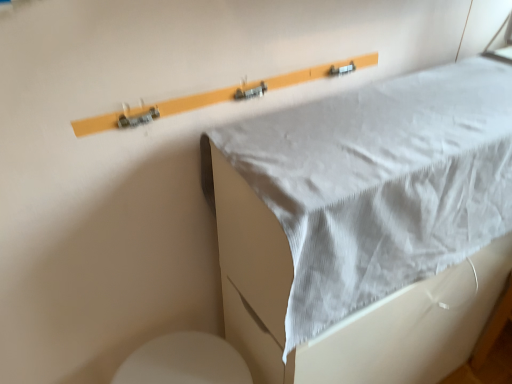
I want to click on free space above white glossy toilet at lower left (from a real-world perspective), so click(177, 363).